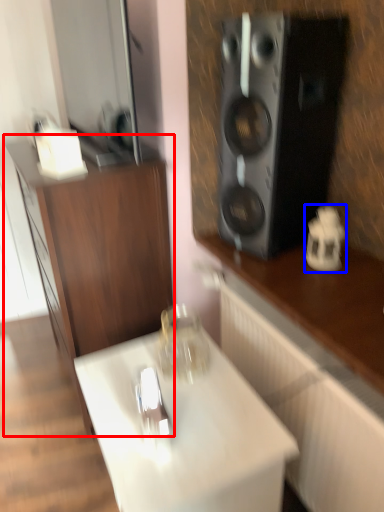
Question: Which object appears closest to the camera in this image, cabinetry (highlighted by a red box) or appliance (highlighted by a blue box)?

Choices:
 (A) cabinetry
 (B) appliance

Answer: (A)